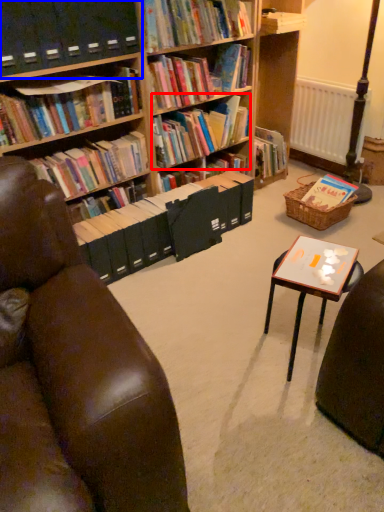
Question: Which object is further to the camera taking this photo, book (highlighted by a red box) or shelf (highlighted by a blue box)?

Choices:
 (A) book
 (B) shelf

Answer: (A)